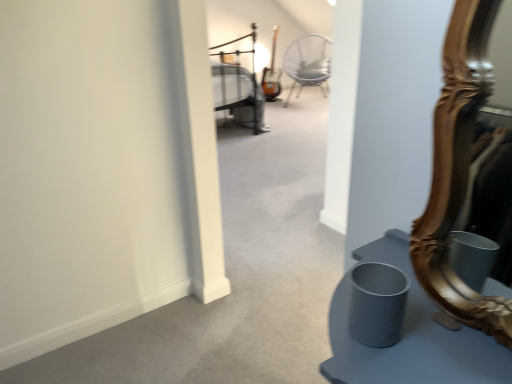
Question: Is gold carved mirror at right looking in the opposite direction of metallic silver bed at upper center?

Choices:
 (A) yes
 (B) no

Answer: (B)

Question: Would you say gold carved mirror at right is outside metallic silver bed at upper center?

Choices:
 (A) no
 (B) yes

Answer: (B)

Question: Is gold carved mirror at right wider than metallic silver bed at upper center?

Choices:
 (A) no
 (B) yes

Answer: (A)

Question: From a real-world perspective, is gold carved mirror at right located beneath metallic silver bed at upper center?

Choices:
 (A) yes
 (B) no

Answer: (B)

Question: Is gold carved mirror at right to the left of metallic silver bed at upper center from the viewer's perspective?

Choices:
 (A) yes
 (B) no

Answer: (B)

Question: Does gold carved mirror at right contain metallic silver bed at upper center?

Choices:
 (A) no
 (B) yes

Answer: (A)

Question: Is metallic silver chair at center looking in the opposite direction of metallic silver bed at upper center?

Choices:
 (A) no
 (B) yes

Answer: (A)

Question: Is metallic silver chair at center closer to camera compared to metallic silver bed at upper center?

Choices:
 (A) no
 (B) yes

Answer: (A)

Question: Could you tell me if metallic silver chair at center is turned towards metallic silver bed at upper center?

Choices:
 (A) no
 (B) yes

Answer: (A)

Question: Does metallic silver chair at center appear on the left side of metallic silver bed at upper center?

Choices:
 (A) no
 (B) yes

Answer: (A)

Question: Can you confirm if metallic silver chair at center is positioned to the right of metallic silver bed at upper center?

Choices:
 (A) no
 (B) yes

Answer: (B)

Question: Is metallic silver chair at center bigger than metallic silver bed at upper center?

Choices:
 (A) yes
 (B) no

Answer: (B)

Question: Does metallic silver bed at upper center contain metallic silver chair at center?

Choices:
 (A) yes
 (B) no

Answer: (B)